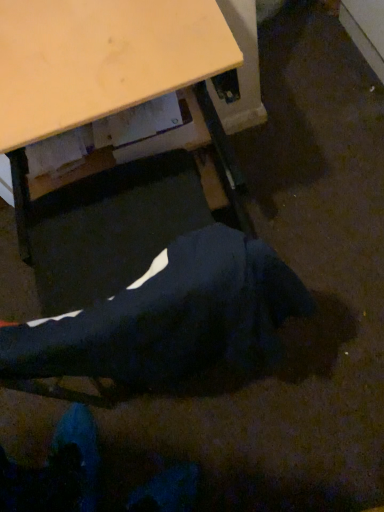
Question: Considering the relative sizes of wooden desk at center and black fabric robe at lower center in the image provided, is wooden desk at center wider than black fabric robe at lower center?

Choices:
 (A) yes
 (B) no

Answer: (A)

Question: Is wooden desk at center smaller than black fabric robe at lower center?

Choices:
 (A) yes
 (B) no

Answer: (B)

Question: Is wooden desk at center shorter than black fabric robe at lower center?

Choices:
 (A) no
 (B) yes

Answer: (A)

Question: Is wooden desk at center bigger than black fabric robe at lower center?

Choices:
 (A) no
 (B) yes

Answer: (B)

Question: From a real-world perspective, does wooden desk at center sit lower than black fabric robe at lower center?

Choices:
 (A) no
 (B) yes

Answer: (B)

Question: Is wooden desk at center not inside black fabric robe at lower center?

Choices:
 (A) yes
 (B) no

Answer: (A)

Question: From a real-world perspective, is black fabric robe at lower center on top of wooden desk at center?

Choices:
 (A) no
 (B) yes

Answer: (B)

Question: From a real-world perspective, is black fabric robe at lower center physically below wooden desk at center?

Choices:
 (A) yes
 (B) no

Answer: (B)

Question: Is black fabric robe at lower center at the right side of wooden desk at center?

Choices:
 (A) yes
 (B) no

Answer: (A)

Question: Can you confirm if black fabric robe at lower center is positioned to the left of wooden desk at center?

Choices:
 (A) yes
 (B) no

Answer: (B)

Question: Is black fabric robe at lower center bigger than wooden desk at center?

Choices:
 (A) yes
 (B) no

Answer: (B)

Question: Is black fabric robe at lower center oriented away from wooden desk at center?

Choices:
 (A) no
 (B) yes

Answer: (A)

Question: Is wooden desk at center wider or thinner than black fabric robe at lower center?

Choices:
 (A) thin
 (B) wide

Answer: (B)